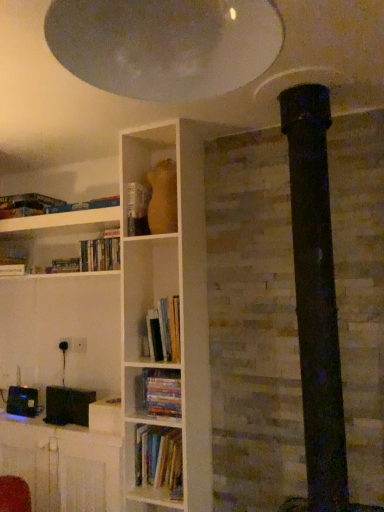
This screenshot has width=384, height=512. What do you see at coordinates (63, 465) in the screenshot?
I see `black plastic table at lower left` at bounding box center [63, 465].

Measure the distance between white glossy exhaust hood at upper center and camera.

The depth of white glossy exhaust hood at upper center is 27.17 inches.

Describe the element at coordinates (163, 331) in the screenshot. I see `hardcover books at center, the 2th book from the top` at that location.

Where is `hardcover books at center, positioned as the 3th book in bottom-to-top order`? The image size is (384, 512). hardcover books at center, positioned as the 3th book in bottom-to-top order is located at coordinates (100, 254).

Find the location of a particular element. This screenshot has width=384, height=512. black plastic table at lower left is located at coordinates (63, 465).

Is hardcover books at center, positioned as the 2th book in bottom-to-top order, at the right side of hardcover books at center, positioned as the 3th book in bottom-to-top order?

Yes.

Which object is thinner, hardcover books at center, positioned as the 2th book in bottom-to-top order, or hardcover books at center, positioned as the 3th book in bottom-to-top order?

hardcover books at center, positioned as the 3th book in bottom-to-top order, is thinner.

I want to click on book behind the hardcover books at center, positioned as the 2th book in bottom-to-top order, so click(100, 254).

Between hardcover books at center, the 2th book from the top, and hardcover books at center, positioned as the 3th book in bottom-to-top order, which one has less height?

With less height is hardcover books at center, positioned as the 3th book in bottom-to-top order.

Relative to hardcover books at center, positioned as the 3th book in bottom-to-top order, is hardcover book at center in front or behind?

Visually, hardcover book at center is located in front of hardcover books at center, positioned as the 3th book in bottom-to-top order.

Is hardcover book at center facing towards hardcover books at center, positioned as the 3th book in bottom-to-top order?

No.

Is hardcover book at center surrounding hardcover books at center, which is the first book from top to bottom?

No, hardcover books at center, which is the first book from top to bottom, is not a part of hardcover book at center.

Who is taller, hardcover books at center, arranged as the first book when ordered from the bottom, or hardcover book at center?

Standing taller between the two is hardcover book at center.

Who is more distant, hardcover books at center, the 3th book viewed from the top, or hardcover book at center?

hardcover book at center.

Is hardcover books at center, arranged as the first book when ordered from the bottom, facing towards hardcover book at center?

No, hardcover books at center, arranged as the first book when ordered from the bottom, does not turn towards hardcover book at center.

How far apart are hardcover books at center, arranged as the first book when ordered from the bottom, and hardcover book at center?

They are 30.85 inches apart.

Consider the image. Considering the relative sizes of white glossy exhaust hood at upper center and hardcover books at center, positioned as the 2th book in bottom-to-top order, in the image provided, is white glossy exhaust hood at upper center taller than hardcover books at center, positioned as the 2th book in bottom-to-top order,?

In fact, white glossy exhaust hood at upper center may be shorter than hardcover books at center, positioned as the 2th book in bottom-to-top order.

Is white glossy exhaust hood at upper center not close to hardcover books at center, the 2th book from the top?

white glossy exhaust hood at upper center is far away from hardcover books at center, the 2th book from the top.

How distant is white glossy exhaust hood at upper center from hardcover books at center, positioned as the 2th book in bottom-to-top order?

A distance of 4.46 feet exists between white glossy exhaust hood at upper center and hardcover books at center, positioned as the 2th book in bottom-to-top order.

Which is in front, point (221, 39) or point (165, 316)?

The point (221, 39) is in front.

From their relative heights in the image, would you say black plastic table at lower left is taller or shorter than white glossy exhaust hood at upper center?

Clearly, black plastic table at lower left is taller compared to white glossy exhaust hood at upper center.

Between point (112, 457) and point (170, 65), which one is positioned in front?

Positioned in front is point (170, 65).

Is black plastic table at lower left positioned far away from white glossy exhaust hood at upper center?

Yes, black plastic table at lower left and white glossy exhaust hood at upper center are located far from each other.

Is black plastic table at lower left smaller than white glossy exhaust hood at upper center?

Actually, black plastic table at lower left might be larger than white glossy exhaust hood at upper center.

In the scene shown: Is hardcover book at center far from white glossy exhaust hood at upper center?

Yes, hardcover book at center and white glossy exhaust hood at upper center are quite far apart.

Considering the relative positions of hardcover book at center and white glossy exhaust hood at upper center in the image provided, is hardcover book at center to the left or to the right of white glossy exhaust hood at upper center?

From the image, it's evident that hardcover book at center is to the left of white glossy exhaust hood at upper center.

Considering the sizes of objects hardcover book at center and white glossy exhaust hood at upper center in the image provided, who is smaller, hardcover book at center or white glossy exhaust hood at upper center?

hardcover book at center is smaller.

Is white glossy exhaust hood at upper center inside hardcover book at center?

No, white glossy exhaust hood at upper center is not a part of hardcover book at center.

Which of these two, hardcover books at center, arranged as the first book when ordered from the bottom, or hardcover books at center, which is the first book from top to bottom, is bigger?

hardcover books at center, which is the first book from top to bottom, is bigger.

Considering the positions of objects hardcover books at center, arranged as the first book when ordered from the bottom, and hardcover books at center, which is the first book from top to bottom, in the image provided, who is more to the right, hardcover books at center, arranged as the first book when ordered from the bottom, or hardcover books at center, which is the first book from top to bottom,?

hardcover books at center, arranged as the first book when ordered from the bottom.

Find the location of `book that is the 1st object located below the hardcover books at center, which is the first book from top to bottom (from the image's perspective)`. book that is the 1st object located below the hardcover books at center, which is the first book from top to bottom (from the image's perspective) is located at coordinates (163, 331).

The image size is (384, 512). There is a hardcover book at center. In order to click on the 1st book below it (from a real-world perspective) in this screenshot , I will do `click(100, 254)`.

Looking at the image, which one is located closer to hardcover books at center, positioned as the 3th book in bottom-to-top order, white glossy exhaust hood at upper center or hardcover books at center, arranged as the first book when ordered from the bottom?

Among the two, hardcover books at center, arranged as the first book when ordered from the bottom, is located nearer to hardcover books at center, positioned as the 3th book in bottom-to-top order.

When comparing their distances from hardcover books at center, arranged as the first book when ordered from the bottom, does black plastic table at lower left or white glossy exhaust hood at upper center seem further?

white glossy exhaust hood at upper center is positioned further to the anchor hardcover books at center, arranged as the first book when ordered from the bottom.

From the image, which object appears to be nearer to hardcover books at center, positioned as the 3th book in bottom-to-top order, hardcover books at center, the 3th book viewed from the top, or white glossy exhaust hood at upper center?

Based on the image, hardcover books at center, the 3th book viewed from the top, appears to be nearer to hardcover books at center, positioned as the 3th book in bottom-to-top order.

Based on their spatial positions, is black plastic table at lower left or hardcover books at center, the 3th book viewed from the top, closer to white glossy exhaust hood at upper center?

hardcover books at center, the 3th book viewed from the top, is positioned closer to the anchor white glossy exhaust hood at upper center.

When comparing their distances from black plastic table at lower left, does hardcover books at center, positioned as the 2th book in bottom-to-top order, or white glossy exhaust hood at upper center seem further?

The object further to black plastic table at lower left is white glossy exhaust hood at upper center.

Based on their spatial positions, is hardcover books at center, the 2th book from the top, or hardcover book at center closer to hardcover books at center, which is the first book from top to bottom?

hardcover book at center lies closer to hardcover books at center, which is the first book from top to bottom, than the other object.

Which object lies further to the anchor point hardcover books at center, which is the first book from top to bottom, black plastic table at lower left or hardcover books at center, the 3th book viewed from the top?

black plastic table at lower left is positioned further to the anchor hardcover books at center, which is the first book from top to bottom.

From the picture: Looking at the image, which one is located further to hardcover book at center, black plastic table at lower left or hardcover books at center, which is the first book from top to bottom?

Among the two, black plastic table at lower left is located further to hardcover book at center.

The image size is (384, 512). Identify the location of book between hardcover books at center, positioned as the 3th book in bottom-to-top order, and hardcover books at center, arranged as the first book when ordered from the bottom, in the up-down direction. (163, 331).

Where is `book between hardcover books at center, the 2th book from the top, and black plastic table at lower left from top to bottom`? The image size is (384, 512). book between hardcover books at center, the 2th book from the top, and black plastic table at lower left from top to bottom is located at coordinates coord(161,392).

I want to click on paperback book located between white glossy exhaust hood at upper center and hardcover books at center, which is the first book from top to bottom, in the depth direction, so click(137, 209).

The image size is (384, 512). Identify the location of table between white glossy exhaust hood at upper center and hardcover book at center from front to back. (63, 465).